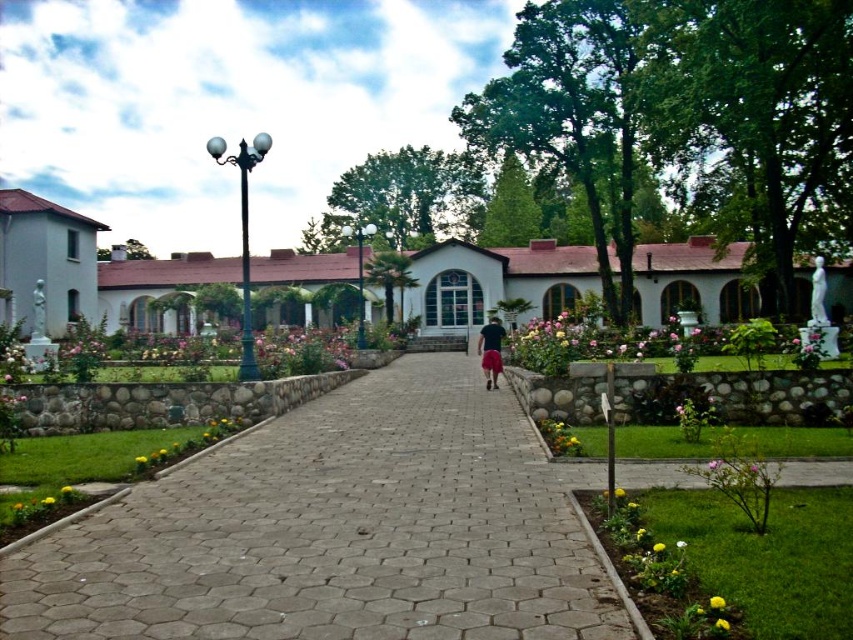
Can you confirm if gray hexagonal paving stone at center is positioned above black fabric shorts at center?

No.

Between point (425, 440) and point (489, 332), which one is positioned behind?

The point (489, 332) is more distant.

Is point (183, 468) in front of point (492, 333)?

Yes, it is.

Find the location of `gray hexagonal paving stone at center`. gray hexagonal paving stone at center is located at coordinates (335, 531).